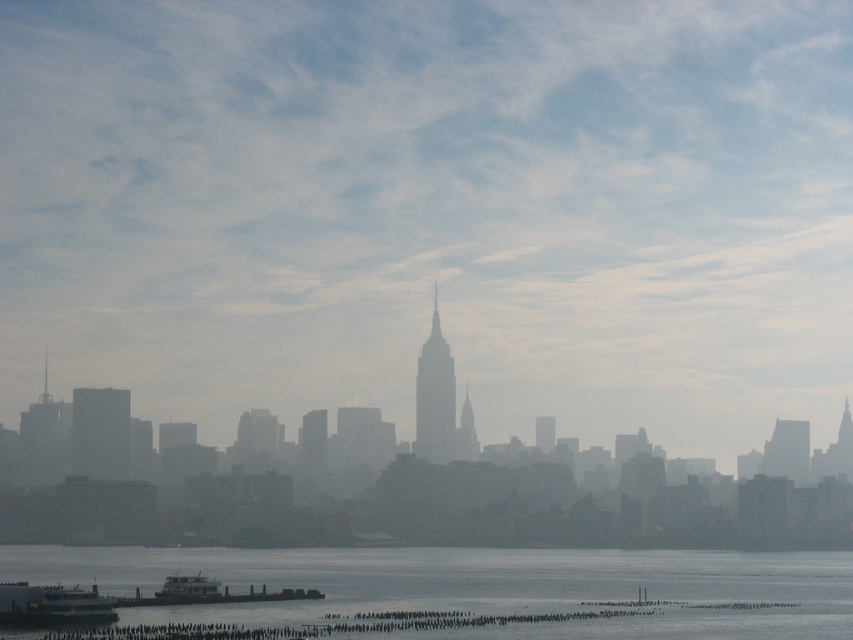
You are a photographer planning to capture the Empire State Building in the foreground with the clear water at lower center in the background. Based on the scene, will the transparent foggy skyline at center interfere with the clarity of the Empire State Building in your photo?

The transparent foggy skyline at center is closer to the viewer than the clear water at lower center. Therefore, the transparent foggy skyline at center will be in front of the clear water at lower center, potentially obscuring or reducing the clarity of the Empire State Building in the foreground.

You are an artist planning to paint the scene. You want to focus on the transparent foggy skyline at center and the clear water at lower center. Which object should you paint larger to maintain the scene as shown?

The transparent foggy skyline at center should be painted larger than the clear water at lower center because it is larger in size according to the description.

You are a photographer standing on the dock and want to capture both the white glossy ferry at lower left and the metallic gray ferry at lower center in your shot. Which ferry should you move closer to in order to include both in the frame without zooming in?

You should move closer to the metallic gray ferry at lower center because the white glossy ferry at lower left is already closer to you. By moving towards the farther ferry, you can balance their distances and fit both into the frame.